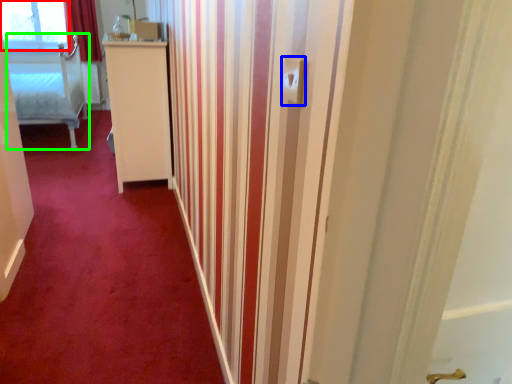
Question: Considering the real-world distances, which object is closest to window (highlighted by a red box)? electric outlet (highlighted by a blue box) or furniture (highlighted by a green box).

Choices:
 (A) electric outlet
 (B) furniture

Answer: (B)